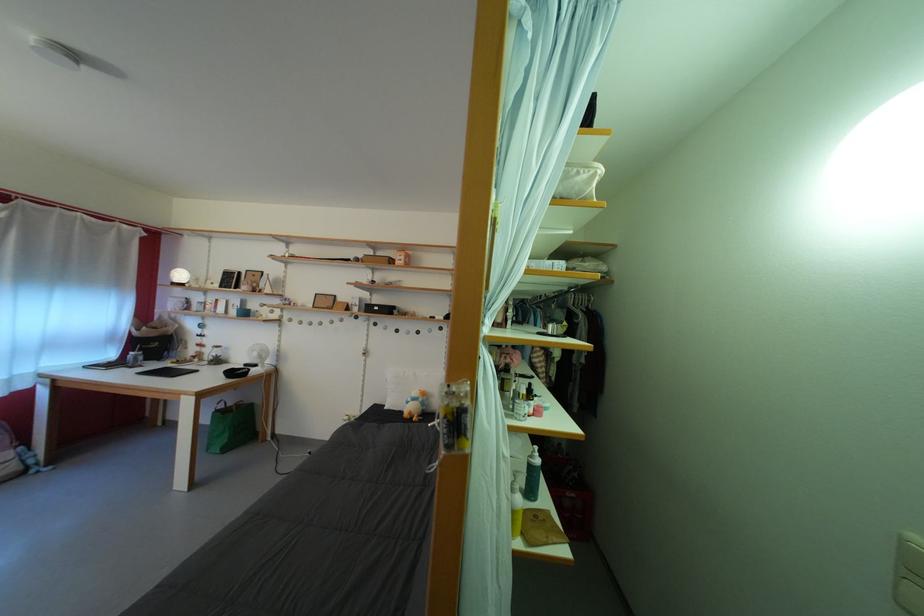
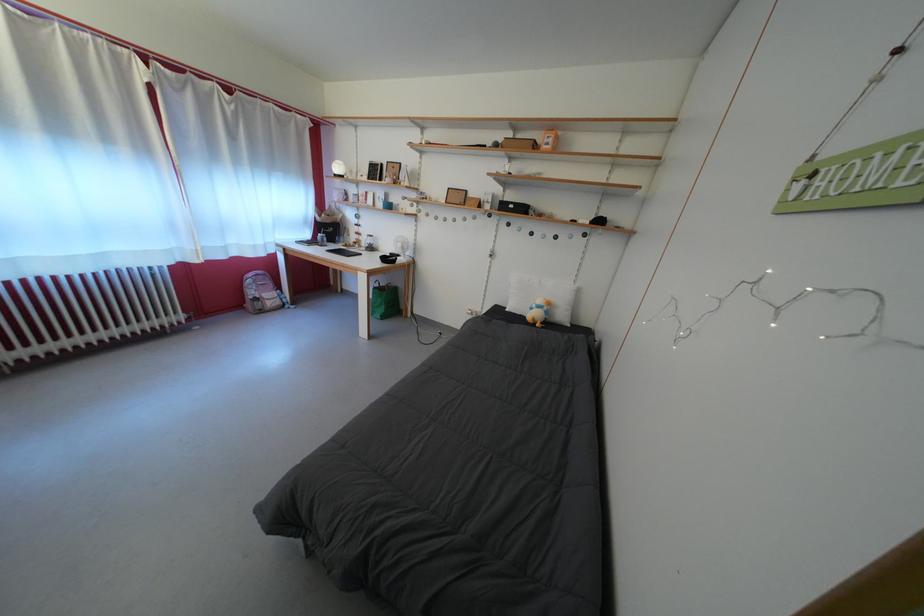
The point at (225, 416) is marked in the first image. Where is the corresponding point in the second image?

(383, 294)